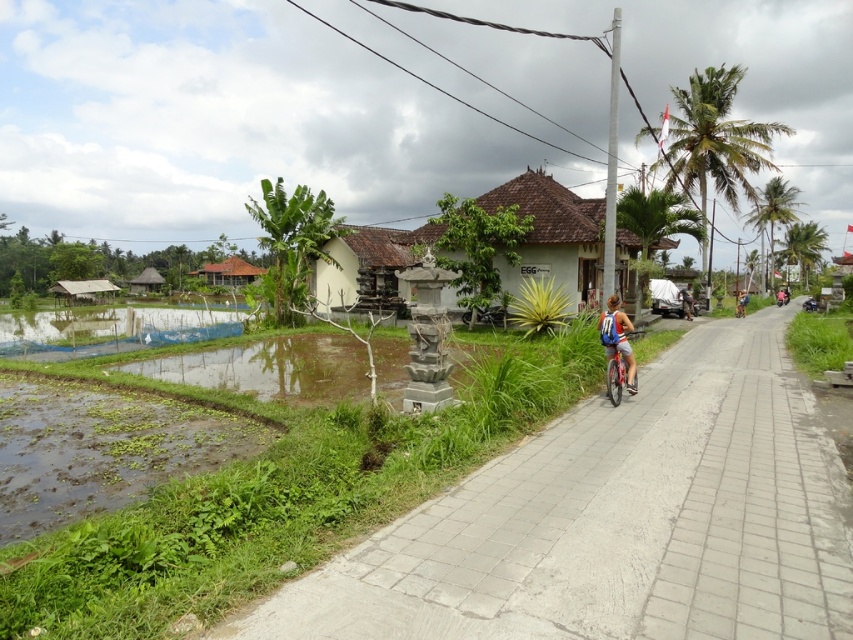
You are standing at the entrance of the traditional building with a sign that reads EGG. You want to walk to the thatched straw hut at left. Which direction should you head towards?

The thatched straw hut at left is located at point (146, 282). Since you are at the entrance of the traditional building with a sign that reads EGG, you should head towards the left direction to reach the thatched straw hut at left.

You are standing at the point with coordinates point (244, 262) and want to walk to the point with coordinates point (608, 298). Based on the scene description, will you have to walk towards the building or away from it?

Since point (608, 298) is in front of point (244, 262), you are walking towards the building.